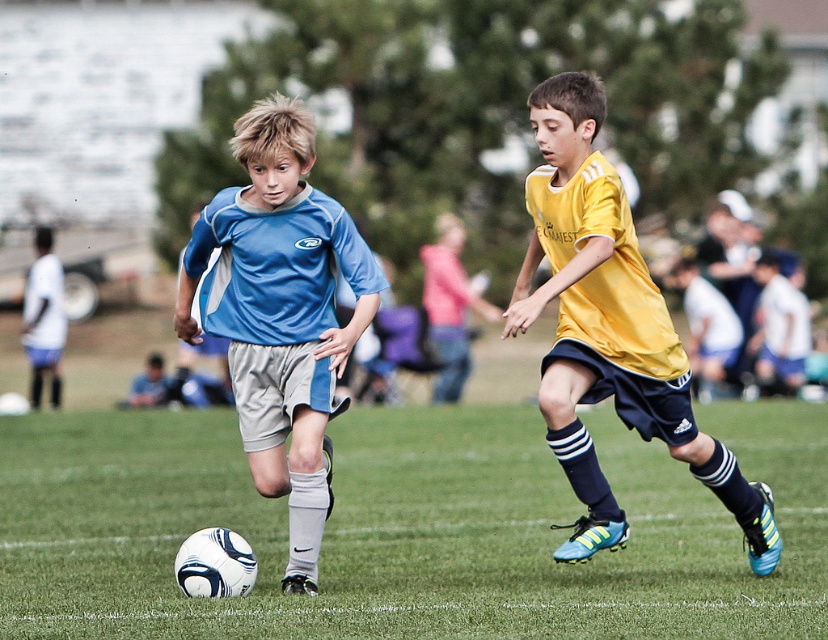
Is green grass at center taller than blue jersey at center?

Incorrect, green grass at center's height is not larger of blue jersey at center's.

Does green grass at center have a lesser height compared to blue jersey at center?

Indeed, green grass at center has a lesser height compared to blue jersey at center.

Find the location of a particular element. Image resolution: width=828 pixels, height=640 pixels. green grass at center is located at coordinates (405, 529).

Is green grass at center thinner than yellow matte jersey at center?

No, green grass at center is not thinner than yellow matte jersey at center.

You are a GUI agent. You are given a task and a screenshot of the screen. Output one action in this format:
    pyautogui.click(x=<x>, y=<y>)
    Task: Click on the green grass at center
    
    Given the screenshot: What is the action you would take?
    pyautogui.click(x=405, y=529)

From the picture: Is blue jersey at center above yellow matte jersey at center?

Yes.

Is blue jersey at center below yellow matte jersey at center?

Incorrect, blue jersey at center is not positioned below yellow matte jersey at center.

Describe the element at coordinates (280, 314) in the screenshot. I see `blue jersey at center` at that location.

At what (x,y) coordinates should I click in order to perform the action: click on blue jersey at center. Please return your answer as a coordinate pair (x, y). Looking at the image, I should click on (280, 314).